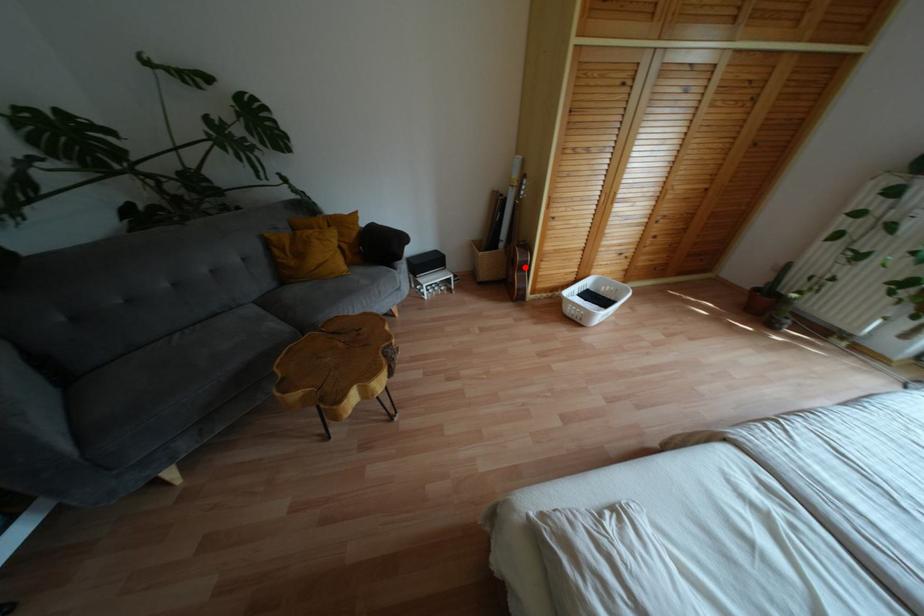
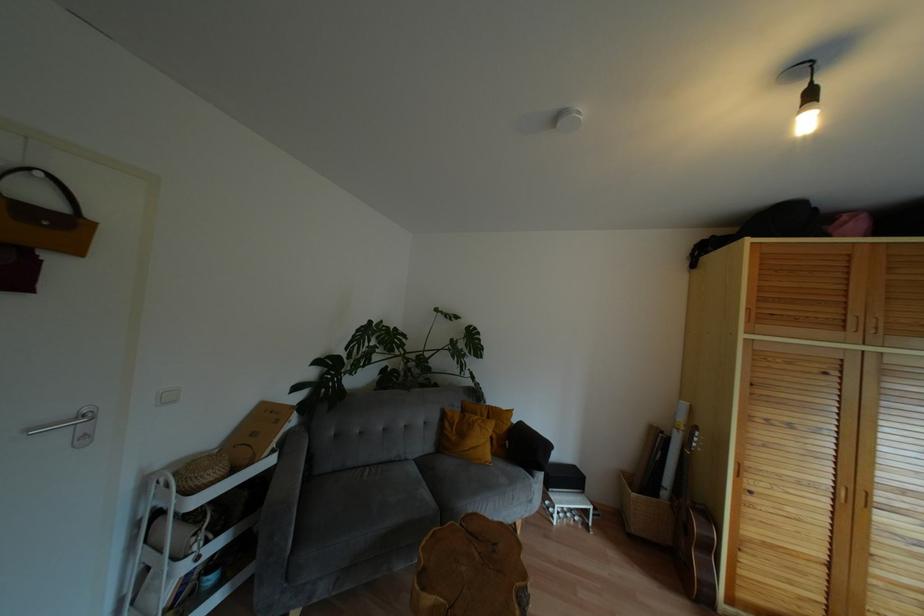
Find the pixel in the second image that matches the highlighted location in the first image.

(710, 548)